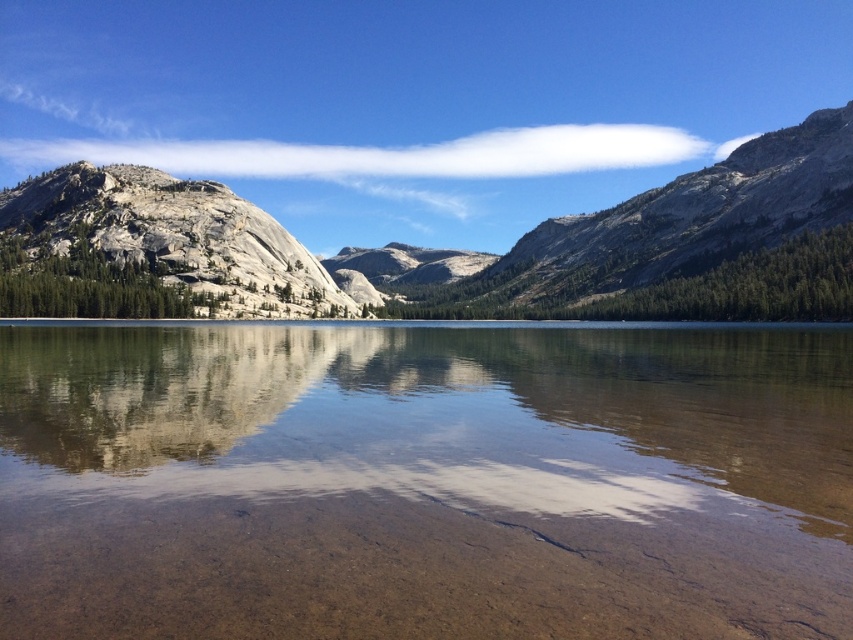
Is granite mountain at center to the right of smooth stone mountain at center from the viewer's perspective?

Correct, you'll find granite mountain at center to the right of smooth stone mountain at center.

Does granite mountain at center appear over smooth stone mountain at center?

Yes, granite mountain at center is above smooth stone mountain at center.

Is point (722, 225) positioned before point (141, 454)?

No, (722, 225) is further to viewer.

This screenshot has width=853, height=640. What are the coordinates of `granite mountain at center` in the screenshot? It's located at (491, 253).

What do you see at coordinates (491, 253) in the screenshot?
I see `granite mountain at center` at bounding box center [491, 253].

Can you confirm if granite mountain at center is shorter than granite mountain at left?

Incorrect, granite mountain at center's height does not fall short of granite mountain at left's.

Where is `granite mountain at center`? Image resolution: width=853 pixels, height=640 pixels. granite mountain at center is located at coordinates 491,253.

Does point (120, 417) come closer to viewer compared to point (207, 253)?

That is True.

Who is positioned more to the left, clear water at center or granite mountain at left?

granite mountain at left

Measure the distance between clear water at center and camera.

clear water at center is 44.16 meters from camera.

You are a GUI agent. You are given a task and a screenshot of the screen. Output one action in this format:
    pyautogui.click(x=<x>, y=<y>)
    Task: Click on the clear water at center
    
    Given the screenshot: What is the action you would take?
    pyautogui.click(x=425, y=481)